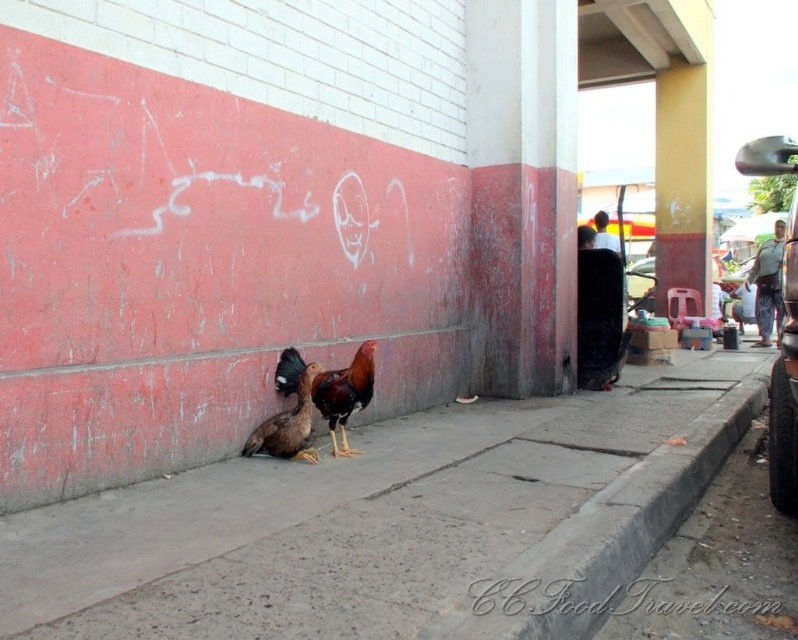
Which of these two, gray concrete curb at lower right or white shirt at center, stands shorter?

Standing shorter between the two is white shirt at center.

Does point (598, 540) come closer to viewer compared to point (603, 234)?

Yes, it is in front of point (603, 234).

Who is more forward, [729,424] or [609,243]?

Positioned in front is point [729,424].

Where is `gray concrete curb at lower right`? Image resolution: width=798 pixels, height=640 pixels. gray concrete curb at lower right is located at coordinates (611, 531).

Can you confirm if metallic gray car at right is positioned below brown feathered chicken at center?

No, metallic gray car at right is not below brown feathered chicken at center.

Describe the element at coordinates (785, 385) in the screenshot. This screenshot has width=798, height=640. I see `metallic gray car at right` at that location.

Where is `metallic gray car at right`? metallic gray car at right is located at coordinates (785, 385).

The image size is (798, 640). Identify the location of metallic gray car at right. (785, 385).

Is denim jacket at lower right positioned in front of white shirt at center?

No, it is behind white shirt at center.

In the scene shown: Can you confirm if denim jacket at lower right is bigger than white shirt at center?

Yes.

Is point (781, 228) positioned before point (603, 220)?

No, it is behind (603, 220).

Identify the location of denim jacket at lower right. (768, 284).